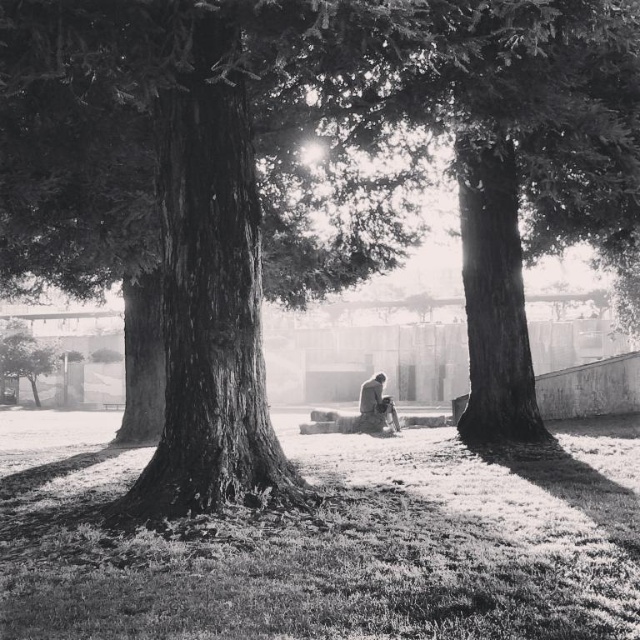
Question: Can you confirm if fuzzy grass at center is positioned above smooth gray stone bench at center?

Choices:
 (A) no
 (B) yes

Answer: (A)

Question: Does fuzzy grass at center have a lesser width compared to smooth gray stone bench at center?

Choices:
 (A) yes
 (B) no

Answer: (B)

Question: Which object appears farthest from the camera in this image?

Choices:
 (A) smooth gray stone bench at center
 (B) fuzzy grass at center

Answer: (A)

Question: Which object is closer to the camera taking this photo?

Choices:
 (A) fuzzy grass at center
 (B) smooth gray stone bench at center

Answer: (A)

Question: Is fuzzy grass at center to the left of smooth gray stone bench at center from the viewer's perspective?

Choices:
 (A) yes
 (B) no

Answer: (A)